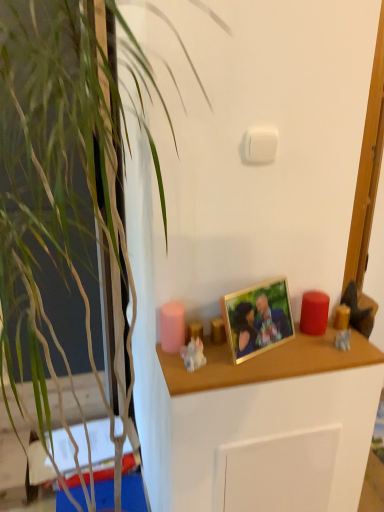
Where is `free space that is to the left of translucent plastic figurine at right, placed as the 1th toy when sorted from back to front`? The width and height of the screenshot is (384, 512). free space that is to the left of translucent plastic figurine at right, placed as the 1th toy when sorted from back to front is located at coordinates (291, 350).